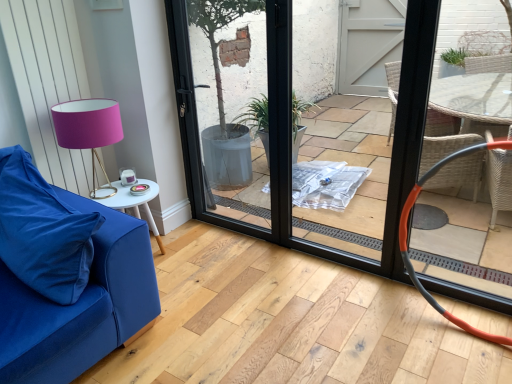
At what (x,y) coordinates should I click in order to perform the action: click on vacant space situated above white glossy side table at lower left (from a real-world perspective). Please return your answer as a coordinate pair (x, y). The height and width of the screenshot is (384, 512). Looking at the image, I should click on (121, 193).